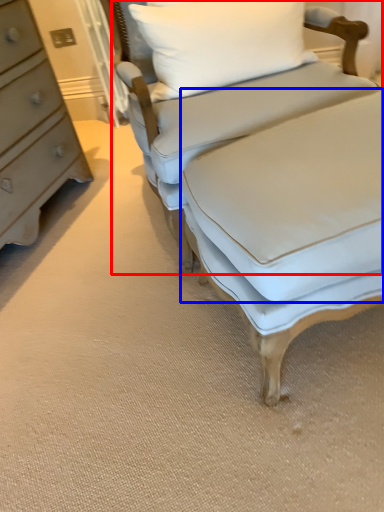
Question: Which point is further to the camera, studio couch (highlighted by a red box) or sheet (highlighted by a blue box)?

Choices:
 (A) studio couch
 (B) sheet

Answer: (A)